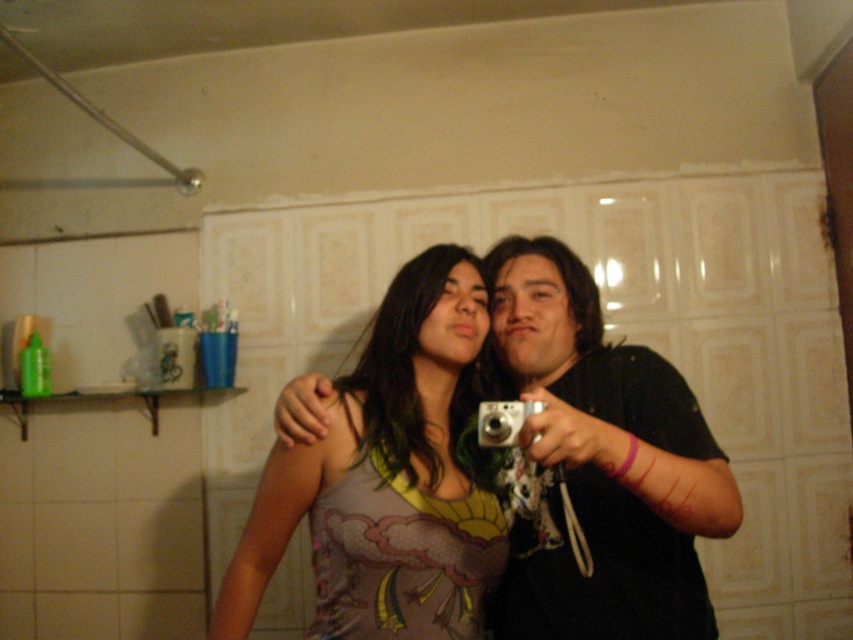
What is the object located at the coordinates point (387, 477) in the image?

The object at point (387, 477) is the matte fabric tank top at center.

From the picture: You are standing in a bathroom and see the black matte camera at center. If you want to place it on the shelf on the left wall, which is located at point 0.65, would it fit?

The black matte camera at center is located at point 0.723, while the shelf on the left wall is at point 0.65. Since the shelf is closer to the left edge, placing the camera there would require moving it leftward, but the description does not provide information about the shelf dimensions or the camera size. Therefore, it is unclear if it will fit.

You are designing a storage box that needs to accommodate both the matte fabric tank top at center and the silver metallic camera at center. Based on their sizes, which object should you prioritize placing first into the box to ensure both fit?

The matte fabric tank top at center is bigger than the silver metallic camera at center, so you should prioritize placing the matte fabric tank top at center first to ensure both fit in the storage box.